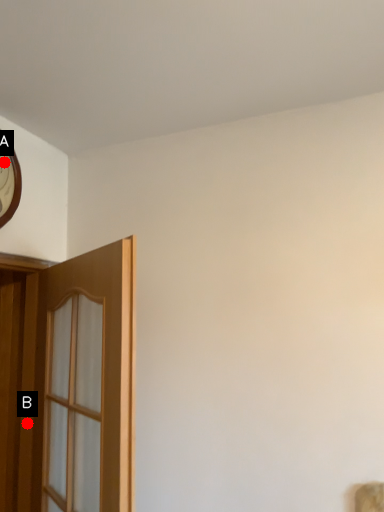
Question: Two points are circled on the image, labeled by A and B beside each circle. Which point is further to the camera?

Choices:
 (A) A is further
 (B) B is further

Answer: (B)